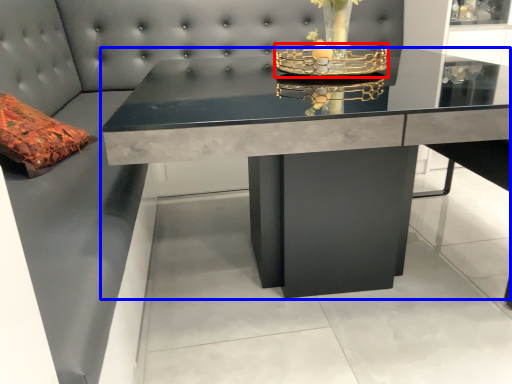
Question: Which object is closer to the camera taking this photo, candle holder (highlighted by a red box) or table (highlighted by a blue box)?

Choices:
 (A) candle holder
 (B) table

Answer: (B)